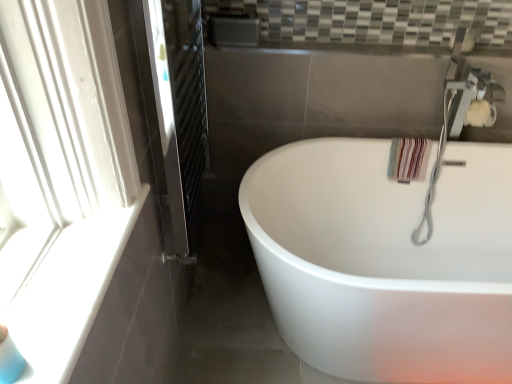
Question: Is white glossy bathtub at center at the left side of clear glass screen door at left?

Choices:
 (A) no
 (B) yes

Answer: (A)

Question: Are white glossy bathtub at center and clear glass screen door at left far apart?

Choices:
 (A) yes
 (B) no

Answer: (B)

Question: Does white glossy bathtub at center have a greater height compared to clear glass screen door at left?

Choices:
 (A) no
 (B) yes

Answer: (A)

Question: Could you tell me if white glossy bathtub at center is facing clear glass screen door at left?

Choices:
 (A) no
 (B) yes

Answer: (A)

Question: Can you confirm if white glossy bathtub at center is bigger than clear glass screen door at left?

Choices:
 (A) no
 (B) yes

Answer: (B)

Question: From their relative heights in the image, would you say silver metallic faucet at upper right is taller or shorter than white glossy bathtub at center?

Choices:
 (A) tall
 (B) short

Answer: (A)

Question: Based on their sizes in the image, would you say silver metallic faucet at upper right is bigger or smaller than white glossy bathtub at center?

Choices:
 (A) small
 (B) big

Answer: (A)

Question: Is silver metallic faucet at upper right inside the boundaries of white glossy bathtub at center, or outside?

Choices:
 (A) inside
 (B) outside

Answer: (A)

Question: Would you say silver metallic faucet at upper right is to the left or to the right of white glossy bathtub at center in the picture?

Choices:
 (A) left
 (B) right

Answer: (B)

Question: In terms of height, does clear glass screen door at left look taller or shorter compared to silver metallic faucet at upper right?

Choices:
 (A) tall
 (B) short

Answer: (A)

Question: Relative to silver metallic faucet at upper right, is clear glass screen door at left in front or behind?

Choices:
 (A) front
 (B) behind

Answer: (A)

Question: Is clear glass screen door at left wider or thinner than silver metallic faucet at upper right?

Choices:
 (A) thin
 (B) wide

Answer: (A)

Question: Is clear glass screen door at left inside the boundaries of silver metallic faucet at upper right, or outside?

Choices:
 (A) inside
 (B) outside

Answer: (B)

Question: Do you think white glossy bathtub at center is within silver metallic faucet at upper right, or outside of it?

Choices:
 (A) inside
 (B) outside

Answer: (B)

Question: Is white glossy bathtub at center wider or thinner than silver metallic faucet at upper right?

Choices:
 (A) wide
 (B) thin

Answer: (A)